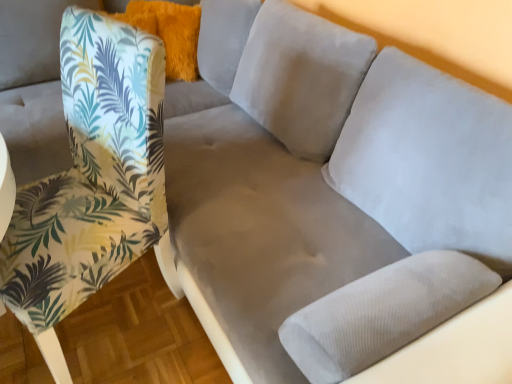
Image resolution: width=512 pixels, height=384 pixels. Describe the element at coordinates (169, 32) in the screenshot. I see `fluffy orange pillow at upper left` at that location.

At what (x,y) coordinates should I click in order to perform the action: click on fluffy orange pillow at upper left. Please return your answer as a coordinate pair (x, y). Looking at the image, I should click on (169, 32).

Locate an element on the screen. This screenshot has width=512, height=384. printed fabric chair at left is located at coordinates (91, 178).

Image resolution: width=512 pixels, height=384 pixels. What do you see at coordinates (91, 178) in the screenshot?
I see `printed fabric chair at left` at bounding box center [91, 178].

The width and height of the screenshot is (512, 384). Find the location of `fluffy orange pillow at upper left`. fluffy orange pillow at upper left is located at coordinates (169, 32).

Can you confirm if fluffy orange pillow at upper left is positioned to the right of printed fabric chair at left?

Yes, fluffy orange pillow at upper left is to the right of printed fabric chair at left.

Which object is further away from the camera, fluffy orange pillow at upper left or printed fabric chair at left?

Positioned behind is fluffy orange pillow at upper left.

Does point (185, 49) lie behind point (42, 234)?

That is True.

From the image's perspective, is fluffy orange pillow at upper left under printed fabric chair at left?

No, from the image's perspective, fluffy orange pillow at upper left is not beneath printed fabric chair at left.

From a real-world perspective, is fluffy orange pillow at upper left over printed fabric chair at left?

Yes, from a real-world perspective, fluffy orange pillow at upper left is above printed fabric chair at left.

Considering the relative sizes of fluffy orange pillow at upper left and printed fabric chair at left in the image provided, is fluffy orange pillow at upper left wider than printed fabric chair at left?

No, fluffy orange pillow at upper left is not wider than printed fabric chair at left.

Is fluffy orange pillow at upper left shorter than printed fabric chair at left?

Indeed, fluffy orange pillow at upper left has a lesser height compared to printed fabric chair at left.

Does fluffy orange pillow at upper left have a smaller size compared to printed fabric chair at left?

Yes, fluffy orange pillow at upper left is smaller than printed fabric chair at left.

Could printed fabric chair at left be considered to be inside fluffy orange pillow at upper left?

No, printed fabric chair at left is not a part of fluffy orange pillow at upper left.

Is there a large distance between fluffy orange pillow at upper left and printed fabric chair at left?

Absolutely, fluffy orange pillow at upper left is distant from printed fabric chair at left.

Is fluffy orange pillow at upper left oriented away from printed fabric chair at left?

That's not correct — fluffy orange pillow at upper left is not looking away from printed fabric chair at left.

Where is `pillow located above the printed fabric chair at left (from the image's perspective)`? This screenshot has width=512, height=384. pillow located above the printed fabric chair at left (from the image's perspective) is located at coordinates (169, 32).

Looking at this image, is printed fabric chair at left at the right side of fluffy orange pillow at upper left?

No.

Is printed fabric chair at left positioned in front of fluffy orange pillow at upper left?

Yes, printed fabric chair at left is closer to the camera.

Which is nearer, (52, 218) or (196, 56)?

Point (52, 218) is closer to the camera than point (196, 56).

From the image's perspective, is printed fabric chair at left above or below fluffy orange pillow at upper left?

From the image's perspective, printed fabric chair at left appears below fluffy orange pillow at upper left.

From a real-world perspective, is printed fabric chair at left above or below fluffy orange pillow at upper left?

printed fabric chair at left is situated lower than fluffy orange pillow at upper left in the real world.

Can you confirm if printed fabric chair at left is thinner than fluffy orange pillow at upper left?

No, printed fabric chair at left is not thinner than fluffy orange pillow at upper left.

Is printed fabric chair at left shorter than fluffy orange pillow at upper left?

Incorrect, the height of printed fabric chair at left does not fall short of that of fluffy orange pillow at upper left.

Considering the sizes of objects printed fabric chair at left and fluffy orange pillow at upper left in the image provided, who is bigger, printed fabric chair at left or fluffy orange pillow at upper left?

With larger size is printed fabric chair at left.

Is printed fabric chair at left situated inside fluffy orange pillow at upper left or outside?

printed fabric chair at left is located beyond the bounds of fluffy orange pillow at upper left.

Does printed fabric chair at left touch fluffy orange pillow at upper left?

printed fabric chair at left is not next to fluffy orange pillow at upper left, and they're not touching.

Is fluffy orange pillow at upper left at the back of printed fabric chair at left?

No, printed fabric chair at left is not facing away from fluffy orange pillow at upper left.

Identify the location of pillow on the right of printed fabric chair at left. (169, 32).

The image size is (512, 384). What are the coordinates of `pillow on the right of printed fabric chair at left` in the screenshot? It's located at (169, 32).

The image size is (512, 384). In order to click on pillow positioned vertically above the printed fabric chair at left (from a real-world perspective) in this screenshot , I will do `click(169, 32)`.